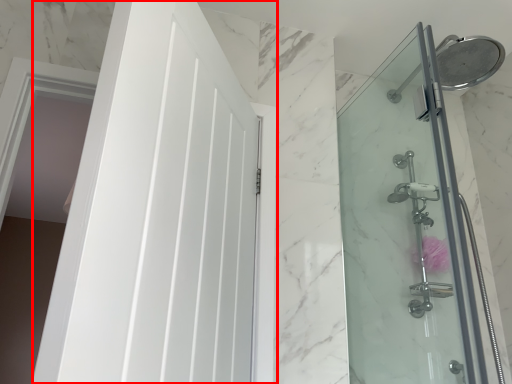
Question: From the image's perspective, where is door (annotated by the red box) located relative to screen door?

Choices:
 (A) below
 (B) above

Answer: (B)